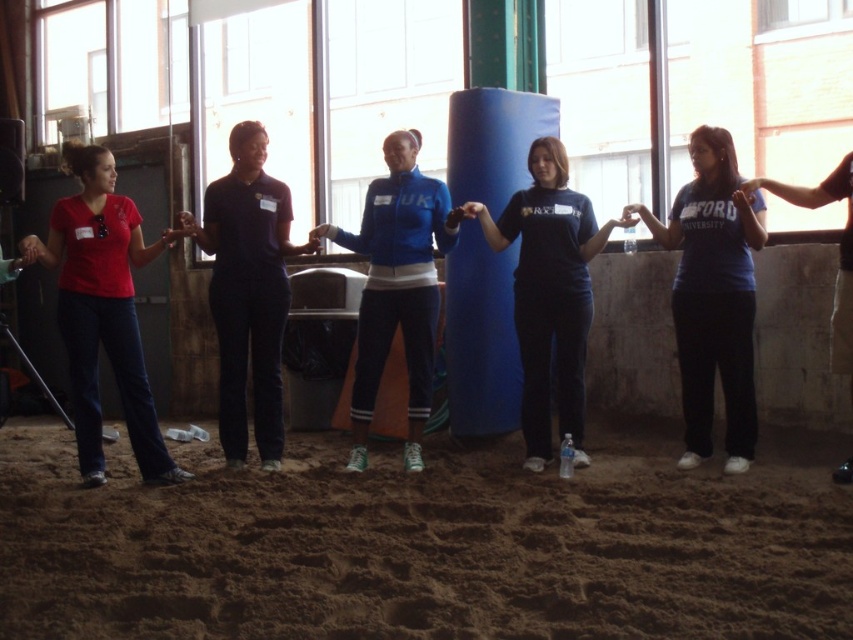
You are a photographer setting up a shot in the room. You need to capture the entire brown sandy ground at lower center and the matte red shirt at left in the frame. Which object should you focus on first to ensure both are in the frame?

The brown sandy ground at lower center has a larger width than the matte red shirt at left, so focusing on it first will help ensure both objects are included in the frame.

You are a photographer trying to capture a closeup of the matte black hand at center and the matte blue jacket at center in the scene. Which object would require you to move closer to get a clear shot?

The matte black hand at center occupies less space than the matte blue jacket at center, so you would need to move closer to the matte black hand at center to capture it clearly.